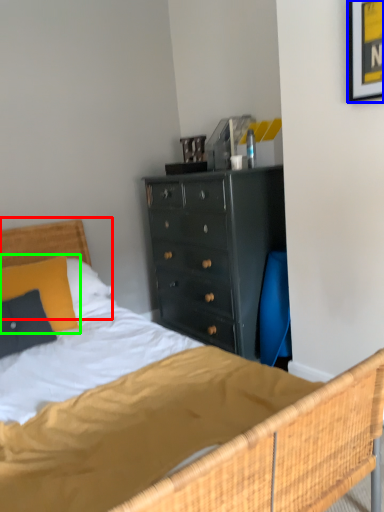
Question: Which is nearer to the headboard (highlighted by a red box)? picture frame (highlighted by a blue box) or pillow (highlighted by a green box).

Choices:
 (A) picture frame
 (B) pillow

Answer: (B)